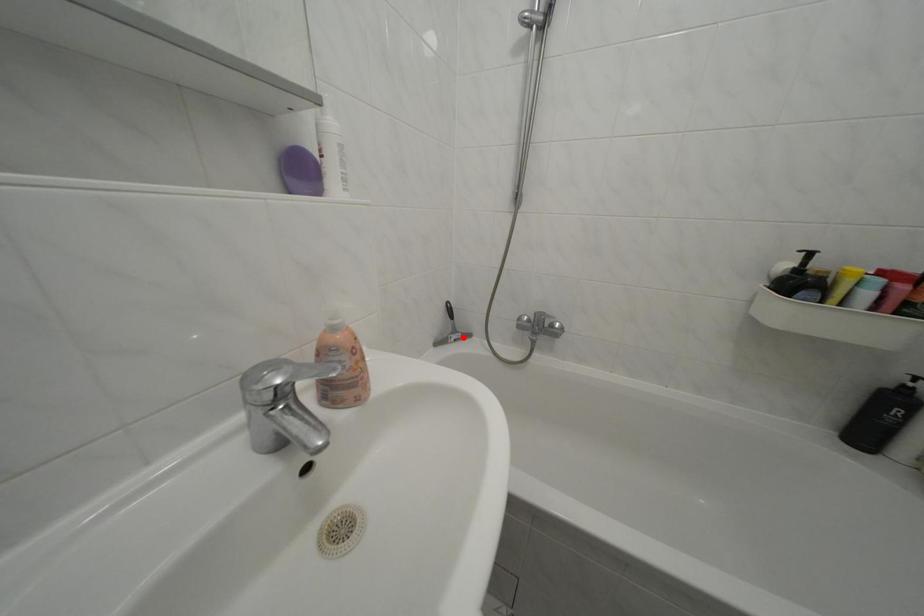
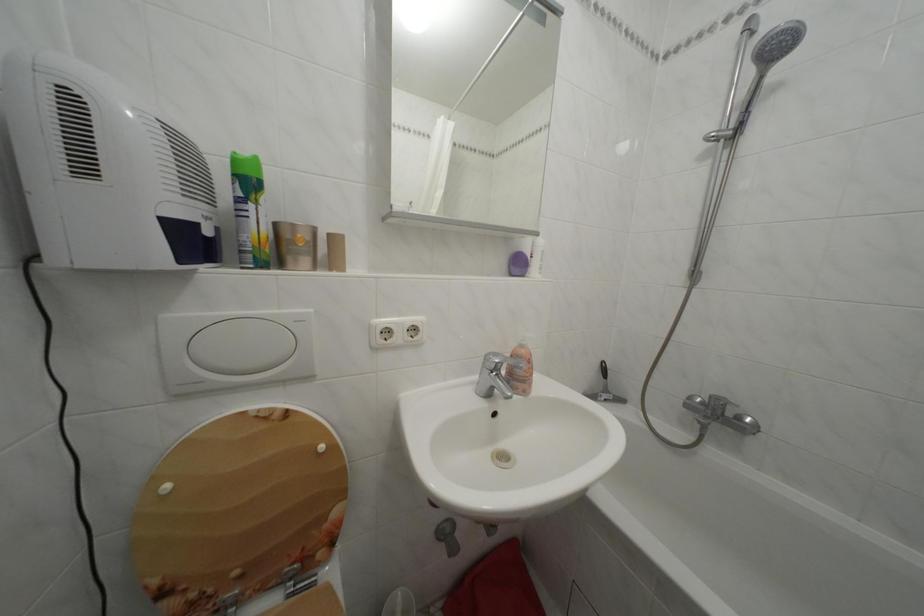
Question: I am providing you with two images of the same scene from different viewpoints. Given a red point in image1, look at the same physical point in image2. Is it:

Choices:
 (A) Closer to the viewpoint
 (B) Farther from the viewpoint

Answer: (B)